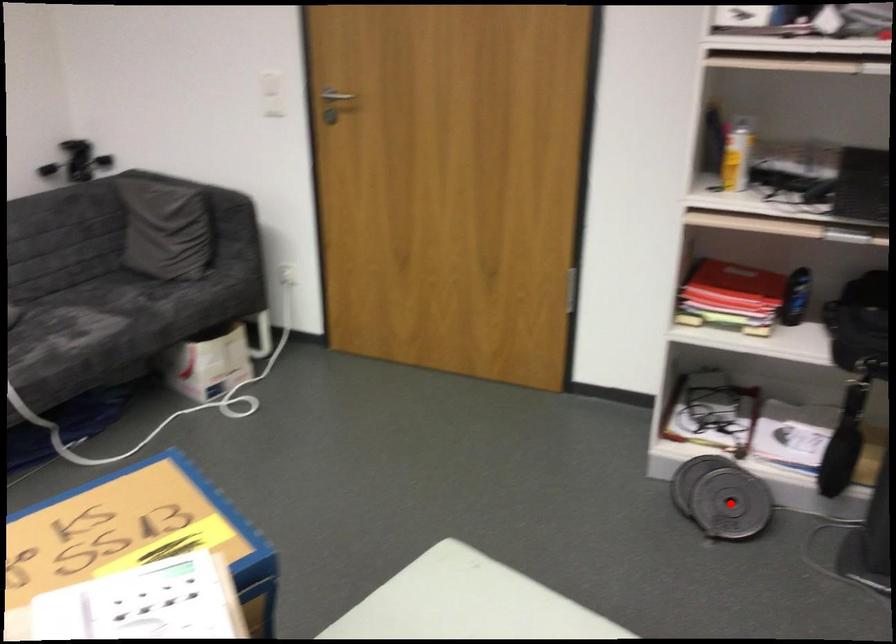
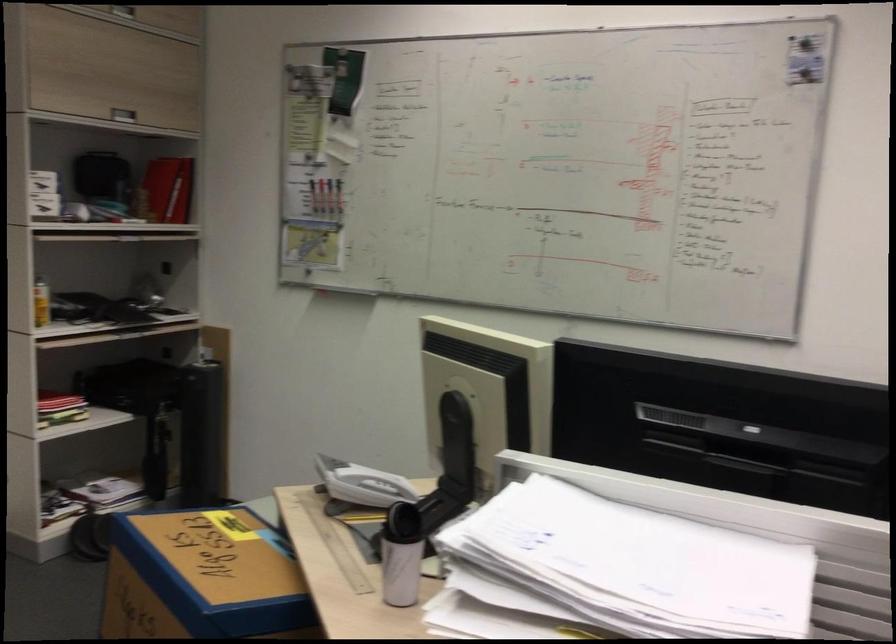
Question: I am providing you with two images of the same scene from different viewpoints. A red point is marked on the first image. Is the red point's position out of view in image 2?

Choices:
 (A) Yes
 (B) No

Answer: (A)